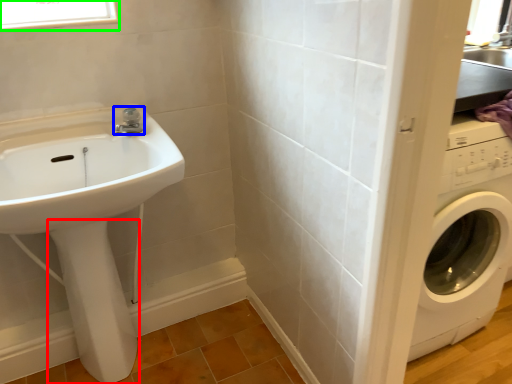
Question: Which object is the closest to the bidet (highlighted by a red box)? Choose among these: tap (highlighted by a blue box) or window (highlighted by a green box).

Choices:
 (A) tap
 (B) window

Answer: (A)